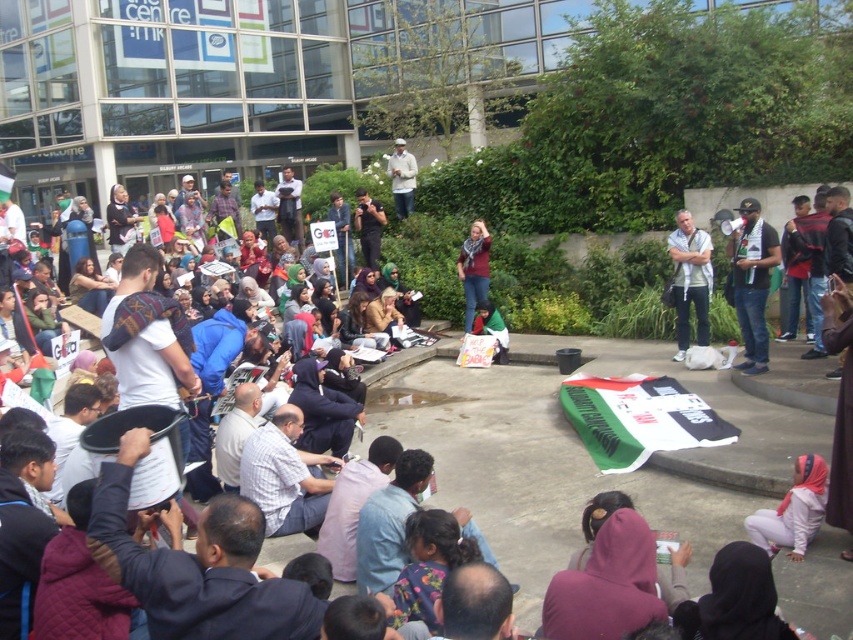
Can you confirm if pale pink fabric headscarf at lower right is wider than white cotton shirt at upper right?

No, pale pink fabric headscarf at lower right is not wider than white cotton shirt at upper right.

Is pale pink fabric headscarf at lower right to the right of white cotton shirt at upper right from the viewer's perspective?

In fact, pale pink fabric headscarf at lower right is to the left of white cotton shirt at upper right.

In order to click on pale pink fabric headscarf at lower right in this screenshot , I will do `click(793, 509)`.

Between jeans at right and red scarf at center, which one has less height?

red scarf at center is shorter.

Which is above, jeans at right or red scarf at center?

red scarf at center is above.

You are a GUI agent. You are given a task and a screenshot of the screen. Output one action in this format:
    pyautogui.click(x=<x>, y=<y>)
    Task: Click on the jeans at right
    This screenshot has height=640, width=853.
    Given the screenshot: What is the action you would take?
    pyautogui.click(x=752, y=282)

Does pale pink fabric headscarf at lower right appear over matte black camera at center?

No.

Is pale pink fabric headscarf at lower right positioned before matte black camera at center?

Yes, pale pink fabric headscarf at lower right is closer to the viewer.

Who is more forward, (778, 532) or (364, 260)?

Point (778, 532) is more forward.

What are the coordinates of `pale pink fabric headscarf at lower right` in the screenshot? It's located at (793, 509).